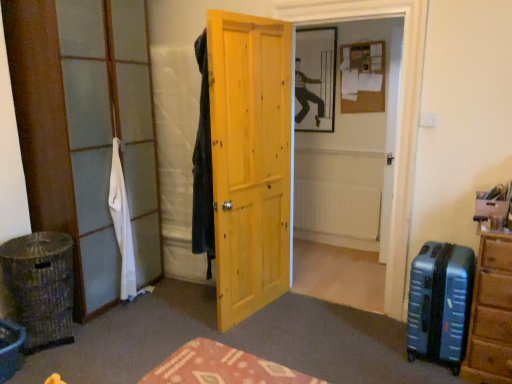
Question: Relative to white matte radiator at center, is clear glass door at left in front or behind?

Choices:
 (A) behind
 (B) front

Answer: (B)

Question: Considering the positions of clear glass door at left and white matte radiator at center in the image, is clear glass door at left taller or shorter than white matte radiator at center?

Choices:
 (A) tall
 (B) short

Answer: (A)

Question: Which of these objects is positioned closest to the white fabric at left?

Choices:
 (A) brown woven laundry basket at lower left
 (B) blue hardshell suitcase at right
 (C) white matte radiator at center
 (D) patterned fabric tablecloth at center
 (E) yellow wood door at center

Answer: (A)

Question: Which of these objects is positioned farthest from the white matte radiator at center?

Choices:
 (A) patterned fabric tablecloth at center
 (B) yellow wood door at center
 (C) brown woven laundry basket at lower left
 (D) clear glass door at left
 (E) white fabric at left

Answer: (C)